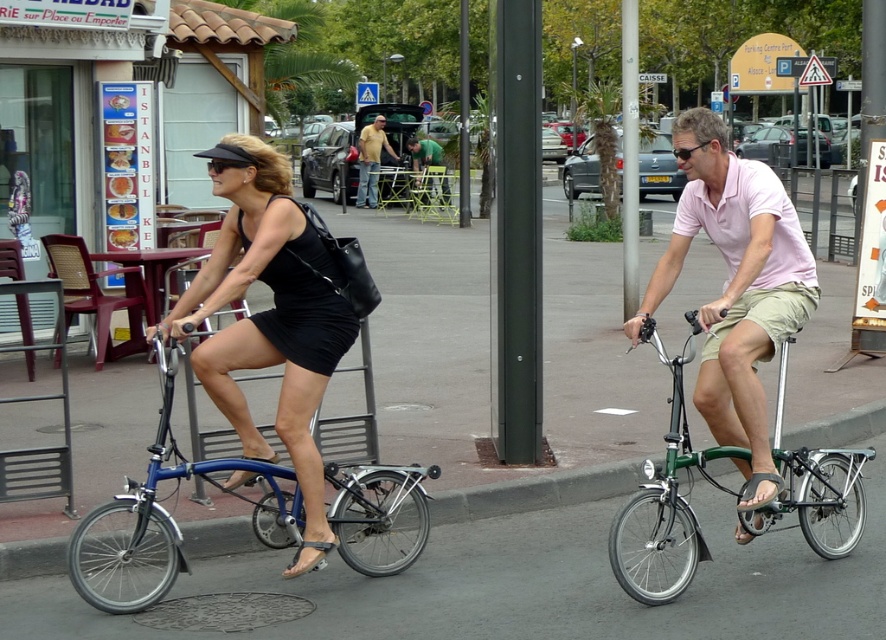
You are a delivery person who needs to park your vehicle. You have a blue metallic bicycle at left and a dark green metallic pole at center. Which one can you park closer to the sidewalk?

The blue metallic bicycle at left is bigger than the dark green metallic pole at center, so you can park the blue metallic bicycle at left closer to the sidewalk since it requires more space.

You are a delivery person who needs to park your bike between the blue metallic bicycle at left and the dark green metallic pole at center. The parking space must be at least 8 feet long. Can you fit your bike there?

The distance between the blue metallic bicycle at left and the dark green metallic pole at center is 7.32 feet, which is shorter than the required 8 feet. Therefore, the parking space is not long enough to accommodate your bike.

Based on the photo, you are a pedestrian walking on the sidewalk and see the green metallic pole at center and the green fabric shirt at center. Which one is higher from the ground?

The green metallic pole at center is higher from the ground than the green fabric shirt at center because it is positioned above it.